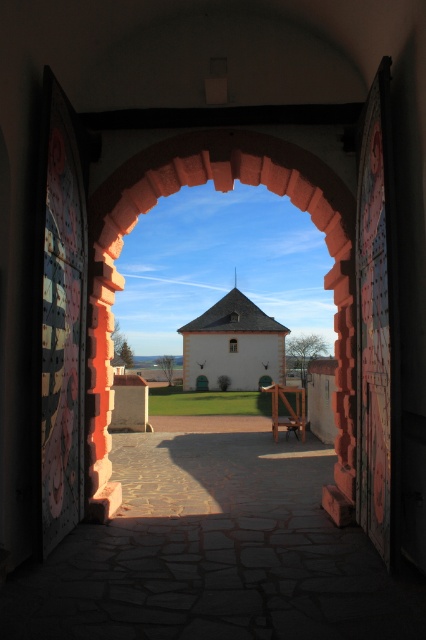
Question: Which object is positioned closest to the brick stone archway at center?

Choices:
 (A) white smooth stone chapel at center
 (B) clear glass window at center

Answer: (A)

Question: Is brick stone archway at center bigger than clear glass window at center?

Choices:
 (A) yes
 (B) no

Answer: (A)

Question: Can you confirm if brick stone archway at center is bigger than clear glass window at center?

Choices:
 (A) no
 (B) yes

Answer: (B)

Question: Is brick stone archway at center to the right of clear glass window at center from the viewer's perspective?

Choices:
 (A) no
 (B) yes

Answer: (A)

Question: Which of the following is the farthest from the observer?

Choices:
 (A) white smooth stone chapel at center
 (B) brick stone archway at center
 (C) clear glass window at center

Answer: (C)

Question: Among these objects, which one is nearest to the camera?

Choices:
 (A) brick stone archway at center
 (B) clear glass window at center

Answer: (A)